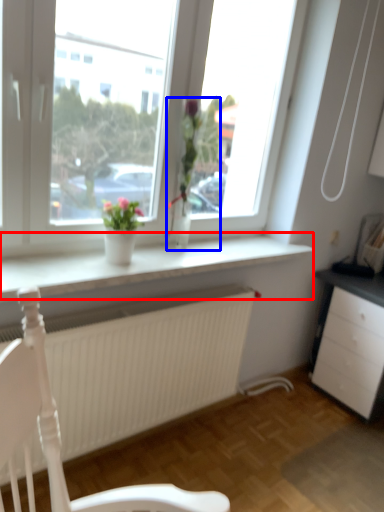
Question: Which point is further to the camera, window sill (highlighted by a red box) or houseplant (highlighted by a blue box)?

Choices:
 (A) window sill
 (B) houseplant

Answer: (B)